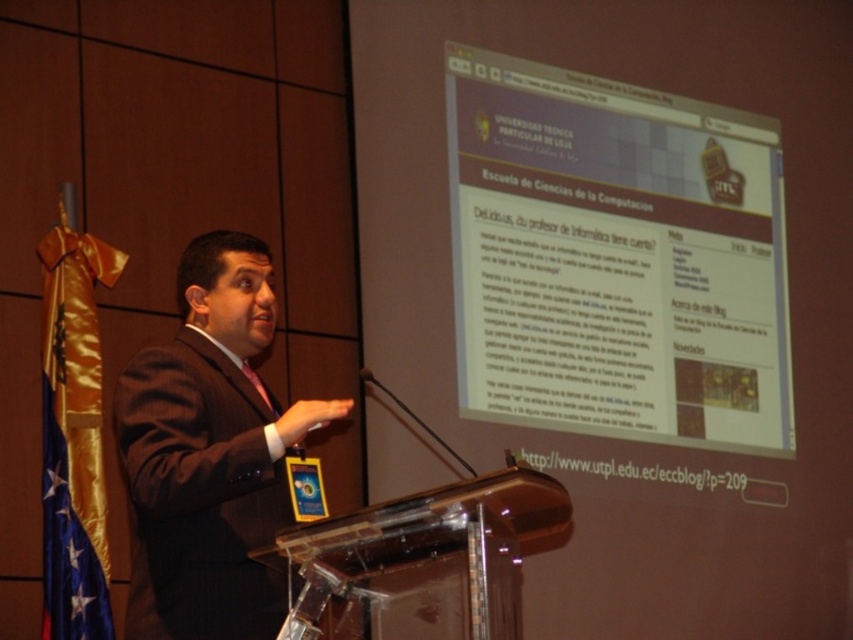
Question: Is matte plastic screen at upper right thinner than blue satin flag at left?

Choices:
 (A) no
 (B) yes

Answer: (A)

Question: Is matte plastic screen at upper right above brown suit at center?

Choices:
 (A) yes
 (B) no

Answer: (A)

Question: Which object is farther from the camera taking this photo?

Choices:
 (A) matte plastic screen at upper right
 (B) brown suit at center
 (C) blue satin flag at left

Answer: (A)

Question: Observing the image, what is the correct spatial positioning of brown suit at center in reference to blue satin flag at left?

Choices:
 (A) right
 (B) left

Answer: (A)

Question: Which point appears closest to the camera in this image?

Choices:
 (A) (218, 413)
 (B) (84, 502)

Answer: (A)

Question: Estimate the real-world distances between objects in this image. Which object is farther from the matte plastic screen at upper right?

Choices:
 (A) brown suit at center
 (B) blue satin flag at left

Answer: (B)